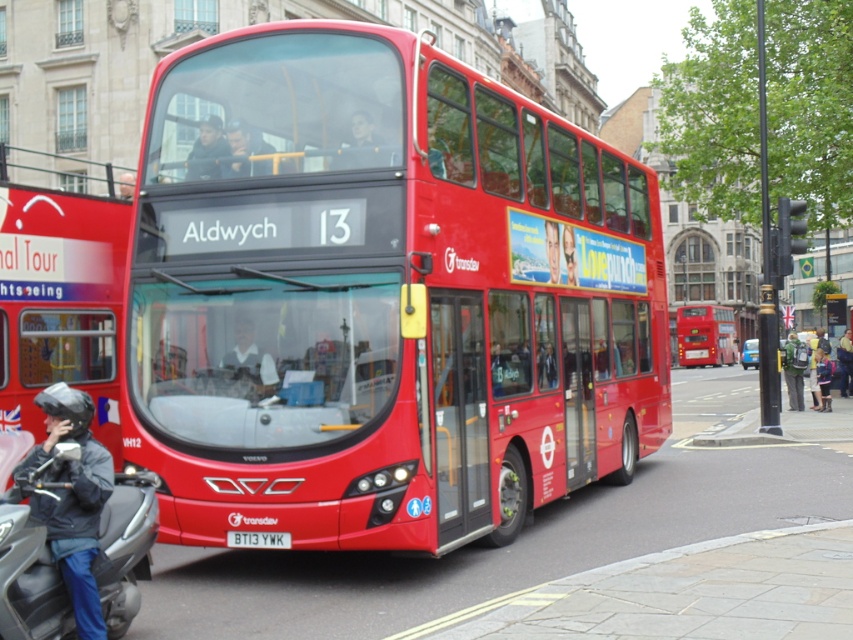
Between black leather helmet at lower left and matte red bus at center, which one appears on the right side from the viewer's perspective?

Positioned to the right is matte red bus at center.

This screenshot has height=640, width=853. I want to click on black leather helmet at lower left, so click(x=73, y=499).

Where is `black leather helmet at lower left`? black leather helmet at lower left is located at coordinates (73, 499).

Does shiny red bus at center have a smaller size compared to matte red bus at left?

Indeed, shiny red bus at center has a smaller size compared to matte red bus at left.

How distant is shiny red bus at center from matte red bus at left?

shiny red bus at center is 18.35 meters from matte red bus at left.

The height and width of the screenshot is (640, 853). In order to click on shiny red bus at center in this screenshot , I will do `click(381, 296)`.

Is point (695, 326) closer to viewer compared to point (287, 541)?

No, it is not.

What do you see at coordinates (705, 336) in the screenshot?
I see `matte red bus at center` at bounding box center [705, 336].

Locate an element on the screen. Image resolution: width=853 pixels, height=640 pixels. matte red bus at center is located at coordinates (705, 336).

Find the location of a particular element. matte red bus at center is located at coordinates click(705, 336).